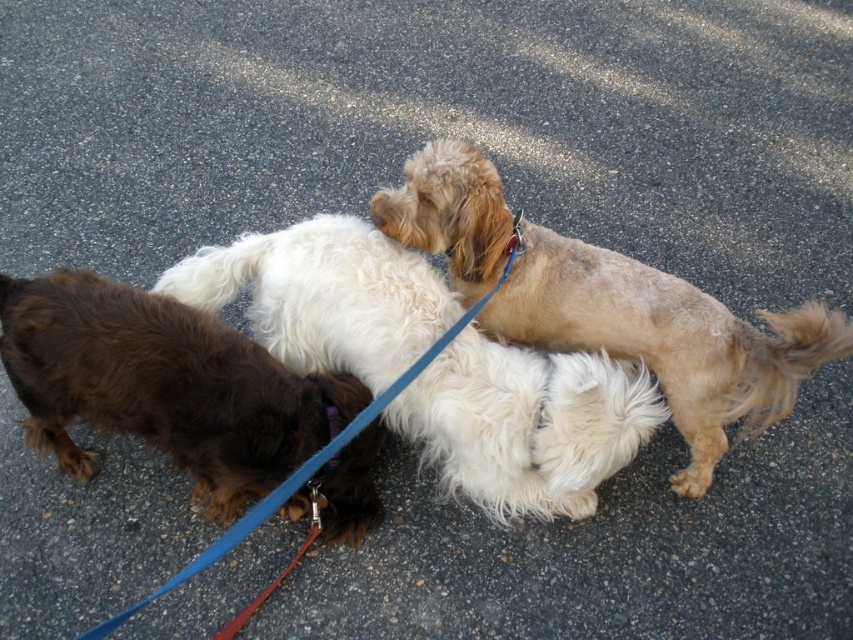
Between shiny brown fur at lower left and blue nylon leash at center, which one has more height?

blue nylon leash at center

Is point (102, 369) positioned after point (509, 262)?

No, (102, 369) is in front of (509, 262).

Locate an element on the screen. This screenshot has width=853, height=640. shiny brown fur at lower left is located at coordinates (161, 385).

Locate an element on the screen. This screenshot has width=853, height=640. light brown fur at center is located at coordinates (665, 339).

Can you confirm if light brown fur at center is positioned to the right of blue nylon leash at center?

Indeed, light brown fur at center is positioned on the right side of blue nylon leash at center.

You are a GUI agent. You are given a task and a screenshot of the screen. Output one action in this format:
    pyautogui.click(x=<x>, y=<y>)
    Task: Click on the light brown fur at center
    
    Given the screenshot: What is the action you would take?
    pyautogui.click(x=665, y=339)

The width and height of the screenshot is (853, 640). In order to click on light brown fur at center in this screenshot , I will do `click(665, 339)`.

In the scene shown: Is shiny brown fur at lower left smaller than light brown fur at center?

Indeed, shiny brown fur at lower left has a smaller size compared to light brown fur at center.

Is shiny brown fur at lower left to the right of light brown fur at center from the viewer's perspective?

Incorrect, shiny brown fur at lower left is not on the right side of light brown fur at center.

Who is more forward, (54, 394) or (689, 305)?

Point (54, 394) is in front.

I want to click on shiny brown fur at lower left, so click(161, 385).